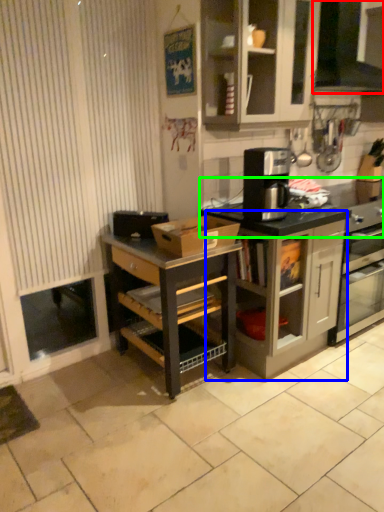
Question: Considering the real-world distances, which object is farthest from vent (highlighted by a red box)? cabinetry (highlighted by a blue box) or countertop (highlighted by a green box)?

Choices:
 (A) cabinetry
 (B) countertop

Answer: (A)